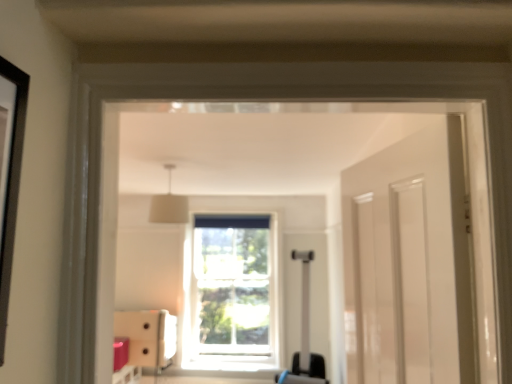
Question: Does white fabric lampshade at upper center have a greater width compared to clear glass window at center?

Choices:
 (A) yes
 (B) no

Answer: (A)

Question: Considering the relative sizes of white fabric lampshade at upper center and clear glass window at center in the image provided, is white fabric lampshade at upper center thinner than clear glass window at center?

Choices:
 (A) no
 (B) yes

Answer: (A)

Question: From the image's perspective, is white fabric lampshade at upper center above clear glass window at center?

Choices:
 (A) yes
 (B) no

Answer: (A)

Question: Is white fabric lampshade at upper center aimed at clear glass window at center?

Choices:
 (A) yes
 (B) no

Answer: (B)

Question: Is white fabric lampshade at upper center smaller than clear glass window at center?

Choices:
 (A) yes
 (B) no

Answer: (A)

Question: Considering the relative positions of white fabric lampshade at upper center and clear glass window at center in the image provided, is white fabric lampshade at upper center in front of clear glass window at center?

Choices:
 (A) yes
 (B) no

Answer: (A)

Question: From the image's perspective, does white fabric lampshade at upper center appear higher than matte white cabinet at lower left?

Choices:
 (A) yes
 (B) no

Answer: (A)

Question: Considering the relative positions of white fabric lampshade at upper center and matte white cabinet at lower left in the image provided, is white fabric lampshade at upper center in front of matte white cabinet at lower left?

Choices:
 (A) yes
 (B) no

Answer: (A)

Question: Can you confirm if white fabric lampshade at upper center is bigger than matte white cabinet at lower left?

Choices:
 (A) yes
 (B) no

Answer: (B)

Question: From a real-world perspective, is white fabric lampshade at upper center below matte white cabinet at lower left?

Choices:
 (A) yes
 (B) no

Answer: (B)

Question: Is white fabric lampshade at upper center further to the viewer compared to matte white cabinet at lower left?

Choices:
 (A) yes
 (B) no

Answer: (B)

Question: Could you tell me if white fabric lampshade at upper center is turned towards matte white cabinet at lower left?

Choices:
 (A) no
 (B) yes

Answer: (A)

Question: From the image's perspective, does clear glass window at center appear higher than white fabric lampshade at upper center?

Choices:
 (A) no
 (B) yes

Answer: (A)